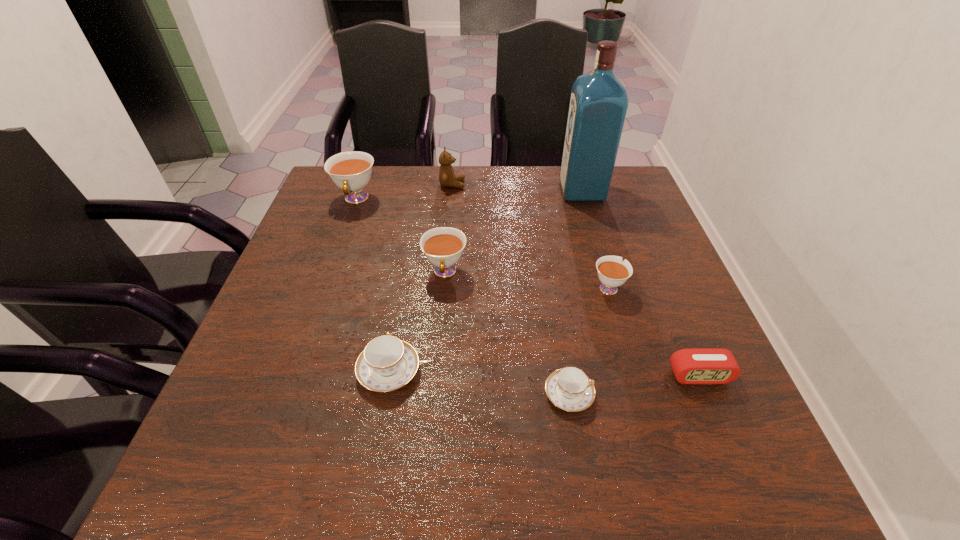
Identify the location of vacant space located 0.110m on the side of the rightmost teacup with the handle. Image resolution: width=960 pixels, height=540 pixels. (595, 244).

At what (x,y) coordinates should I click in order to perform the action: click on free point located 0.290m on the side of the rightmost teacup with the handle. Please return your answer as a coordinate pair (x, y). Looking at the image, I should click on (584, 203).

What are the coordinates of `free space located on the side of the rightmost teacup with the handle` in the screenshot? It's located at (579, 190).

The width and height of the screenshot is (960, 540). Identify the location of vacant space positioned on the side with the handle of the bigger blue teacup. (409, 257).

I want to click on vacant space located 0.250m on the side with the handle of the bigger blue teacup, so click(408, 262).

Find the location of `vacant area located 0.360m on the side with the handle of the bigger blue teacup`. vacant area located 0.360m on the side with the handle of the bigger blue teacup is located at coordinates (413, 234).

This screenshot has width=960, height=540. I want to click on free space located 0.190m on the front-facing side of the rightmost object, so click(x=748, y=491).

Locate an element on the screen. Image resolution: width=960 pixels, height=540 pixels. free space located on the side with the handle of the second teacup from right to left is located at coordinates (713, 394).

Locate an element on the screen. liquor that is at the far edge is located at coordinates (598, 104).

At what (x,y) coordinates should I click in order to perform the action: click on teddy bear positioned at the far edge. Please return your answer as a coordinate pair (x, y). The height and width of the screenshot is (540, 960). Looking at the image, I should click on (447, 178).